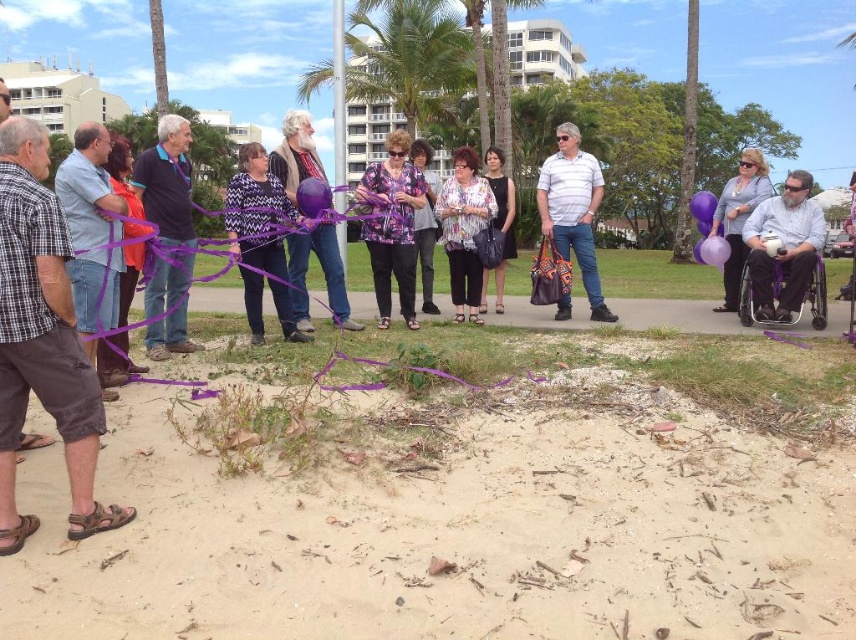
Question: Which point is farther from the camera taking this photo?

Choices:
 (A) (780, 493)
 (B) (716, 308)
 (C) (393, 260)
 (D) (794, 280)

Answer: (B)

Question: Which point is closer to the camera?

Choices:
 (A) (488, 152)
 (B) (389, 179)
 (C) (765, 164)
 (D) (259, 179)

Answer: (D)

Question: Is floral blouse at center positioned behind purple printed blouse at center?

Choices:
 (A) no
 (B) yes

Answer: (B)

Question: Which of these objects is positioned closest to the matte purple balloon at right?

Choices:
 (A) purple printed blouse at center
 (B) metallic purple wheelchair at right

Answer: (B)

Question: Does floral-patterned fabric at center appear over floral blouse at center?

Choices:
 (A) no
 (B) yes

Answer: (A)

Question: Does plaid cotton shirt at left appear on the left side of matte purple balloon at right?

Choices:
 (A) yes
 (B) no

Answer: (A)